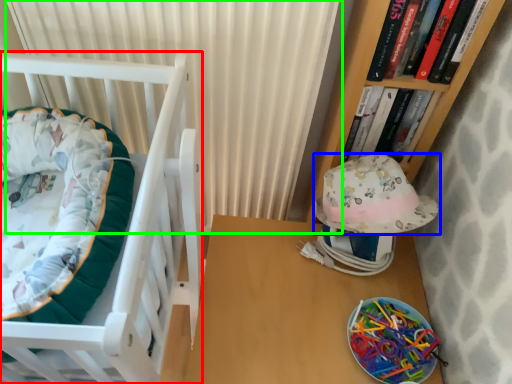
Question: Which object is the farthest from furniture (highlighted by a red box)? Choose among these: hat (highlighted by a blue box) or curtain (highlighted by a green box).

Choices:
 (A) hat
 (B) curtain

Answer: (A)